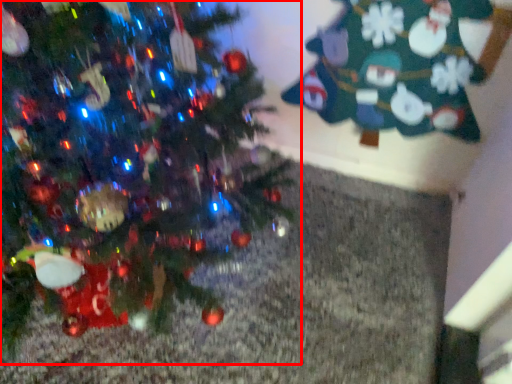
Question: From the image's perspective, where is christmas tree (annotated by the red box) located in relation to christmas tree in the image?

Choices:
 (A) below
 (B) above

Answer: (A)